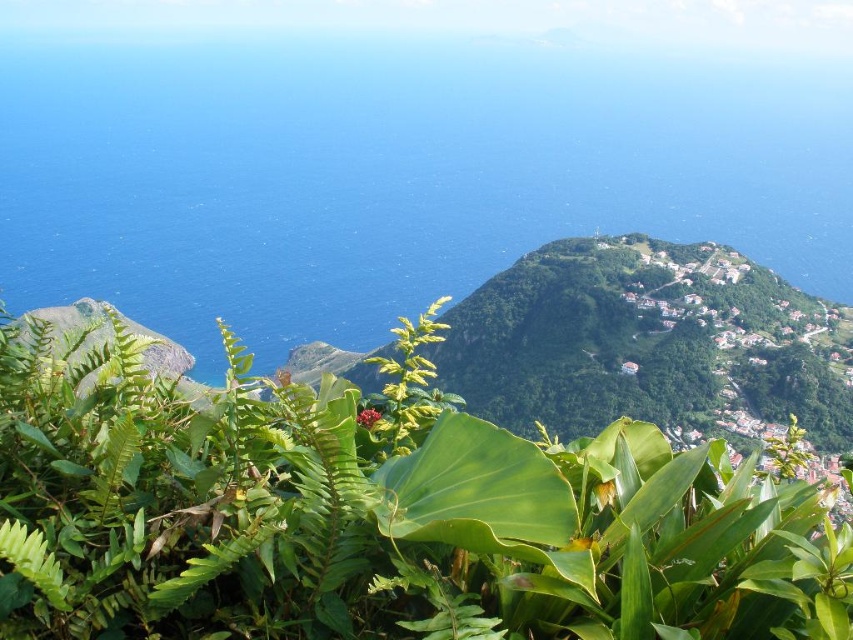
You are standing at the point marked as point (404,484) in the image. Looking around, you see a green leafy plant at center. Is the green leafy plant at center located to your north, south, east, or west?

The green leafy plant at center is located at the point (404,484), which is your current position. Therefore, you are standing directly on top of the green leafy plant at center, so it is neither north, south, east, or west of you.

You are standing at the origin point of the coordinate system in the image. You want to locate the green leafy plant at center. What are its coordinates?

The green leafy plant at center is located at coordinates 0.759 and 0.475.

You are standing at the vantage point looking at the landscape. There are two points marked on the image. Which point is closer to you, point (x=260, y=452) or point (x=96, y=180)?

Point (x=260, y=452) is closer to you because it is in front of point (x=96, y=180).